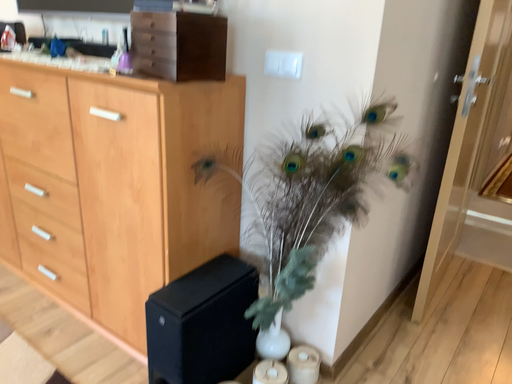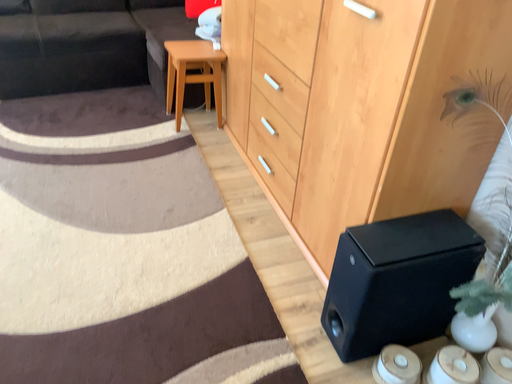
Question: Which way did the camera rotate in the video?

Choices:
 (A) rotated downward
 (B) rotated upward

Answer: (A)